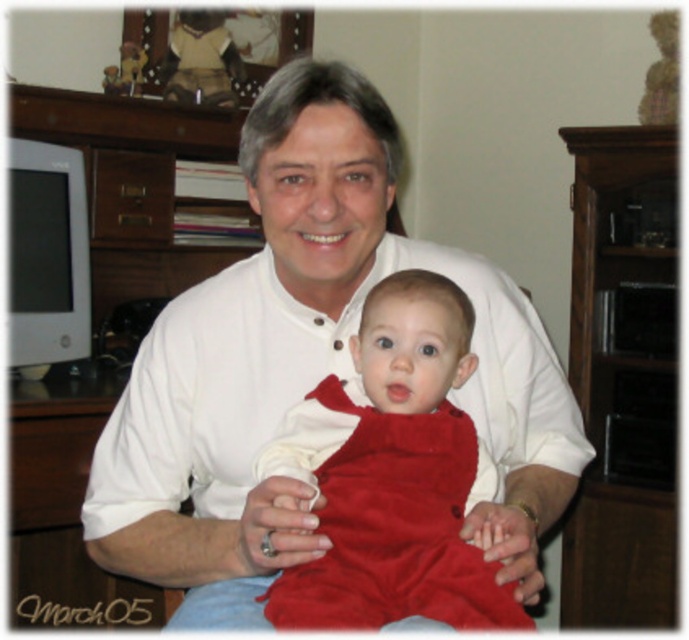
What are the coordinates of the white smooth shirt at center?

The white smooth shirt at center is located at point (x=308, y=369).

You are a photographer adjusting your camera settings to focus on the baby in the image. There is a point at coordinates (x=308, y=369) which is at the center. What object is located at that point?

The white smooth shirt at center is located at point (x=308, y=369).

You are standing in the room and see two points marked in the image. Which point is closer to you, point [351,160] or point [446,470]?

Point [446,470] is closer to you because the description states that point [351,160] is behind point [446,470].